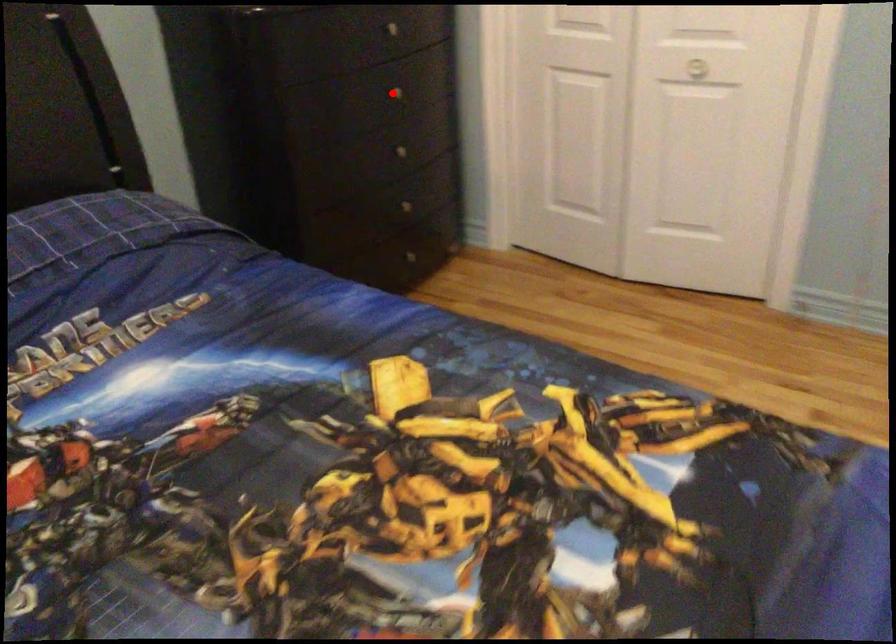
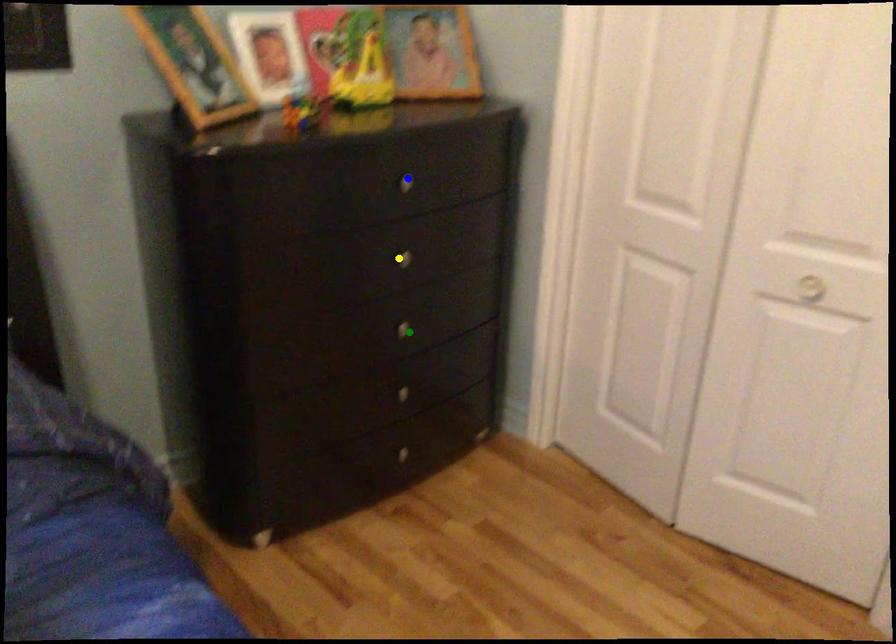
Question: I am providing you with two images of the same scene from different viewpoints. A red point is marked on the first image. You are given multiple points on the second image. Which spot in image 2 lines up with the point in image 1?

Choices:
 (A) green point
 (B) blue point
 (C) yellow point

Answer: (C)